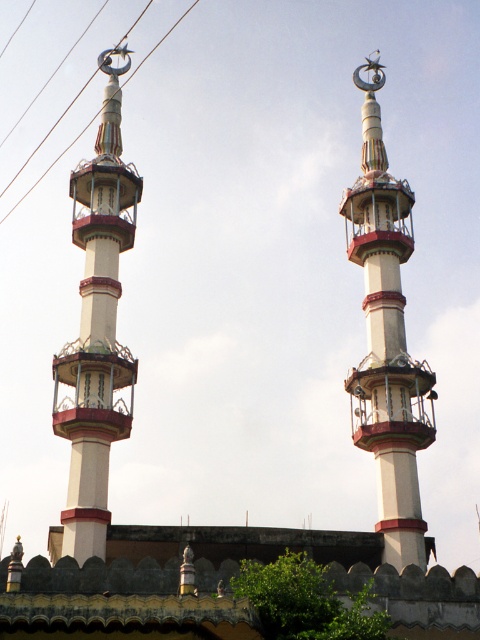
You are an architect designing a new mosque and want to ensure the minarets are proportionate to the central structure. Given the white painted metal minaret at left and the metallic wire at upper center, which one is narrower in width?

The white painted metal minaret at left is narrower in width than the metallic wire at upper center.

You are a photographer positioned in front of the mosque. You want to capture a photo where the white glossy minaret at center is clearly visible without any obstruction. Is the metallic wire at upper center blocking the view of the minaret?

The white glossy minaret at center is in front of the metallic wire at upper center, so the metallic wire at upper center is behind the minaret and does not block its view.